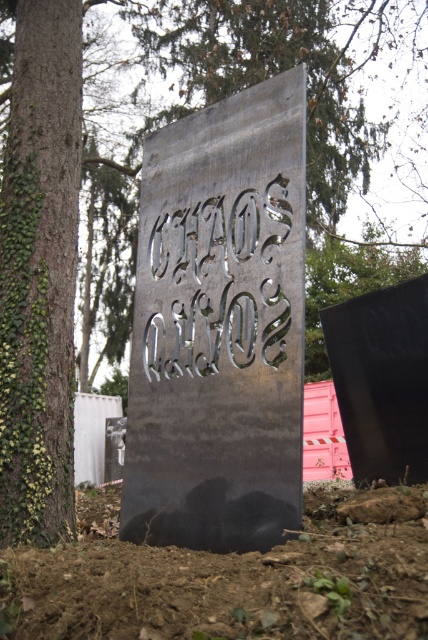
You are standing at point A, which is at coordinates (219, 326). Looking around, you see a metallic gray sign at center. What is the closest object to your current position?

The closest object to your current position at point A is the metallic gray sign at center, as it is located exactly at the coordinates you are standing on.